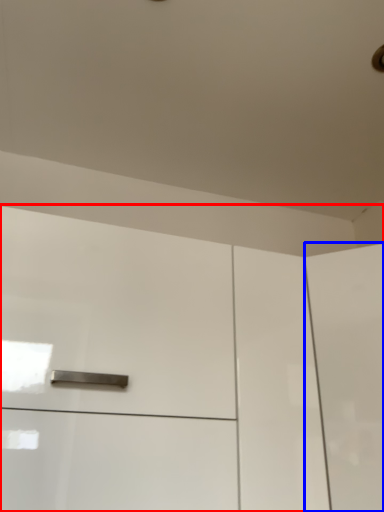
Question: Which object appears farthest to the camera in this image, cabinetry (highlighted by a red box) or screen door (highlighted by a blue box)?

Choices:
 (A) cabinetry
 (B) screen door

Answer: (B)